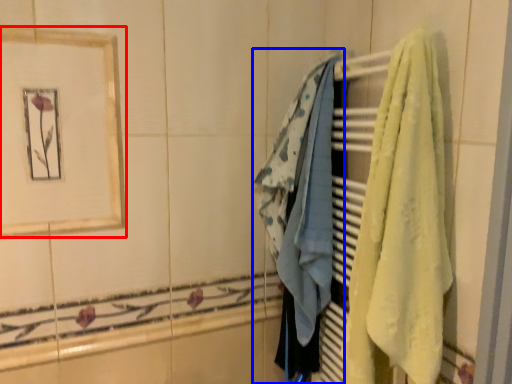
Question: Among these objects, which one is nearest to the camera, picture frame (highlighted by a red box) or towel (highlighted by a blue box)?

Choices:
 (A) picture frame
 (B) towel

Answer: (A)